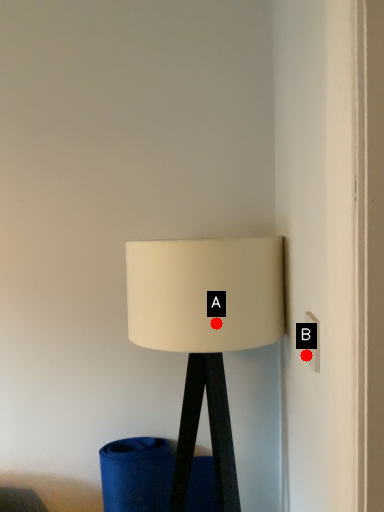
Question: Two points are circled on the image, labeled by A and B beside each circle. Which point is farther to the camera?

Choices:
 (A) A is further
 (B) B is further

Answer: (A)